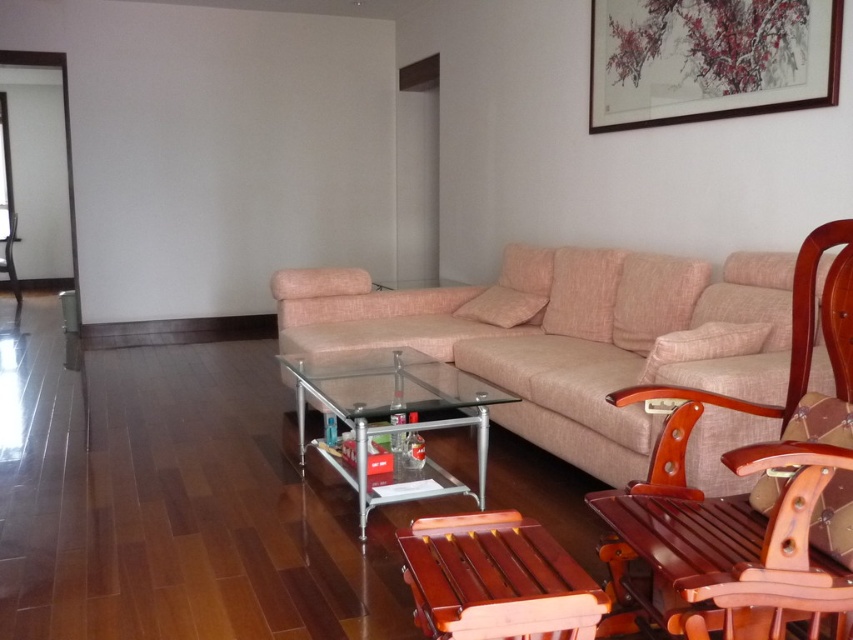
You are a guest entering the living room and want to sit down. Which object, the beige fabric couch at center or the mahogany wood rocking chair at center, is closer to you as you enter the room?

The beige fabric couch at center is closer to you because the mahogany wood rocking chair at center is positioned behind it.